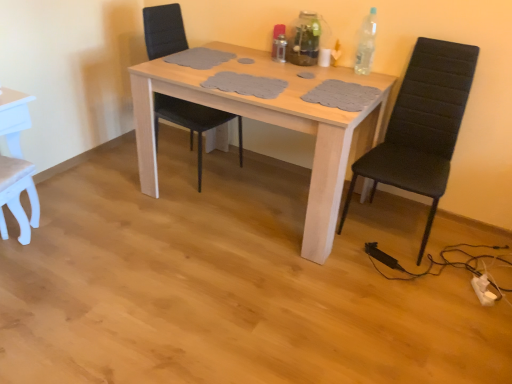
The image size is (512, 384). In order to click on free spot in front of light wood table at center in this screenshot , I will do `click(247, 297)`.